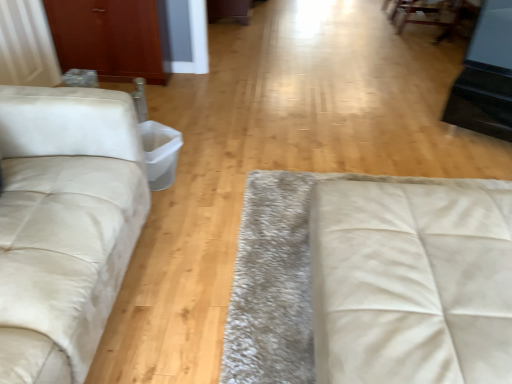
Question: Is suede-like beige studio couch at left, acting as the 1th studio couch starting from the left, outside white leather studio couch at center, placed as the first studio couch when sorted from right to left?

Choices:
 (A) yes
 (B) no

Answer: (A)

Question: Does suede-like beige studio couch at left, acting as the 1th studio couch starting from the left, have a smaller size compared to white leather studio couch at center, placed as the first studio couch when sorted from right to left?

Choices:
 (A) no
 (B) yes

Answer: (A)

Question: Is suede-like beige studio couch at left, acting as the 1th studio couch starting from the left, positioned with its back to white leather studio couch at center, placed as the first studio couch when sorted from right to left?

Choices:
 (A) yes
 (B) no

Answer: (B)

Question: Can you confirm if suede-like beige studio couch at left, the second studio couch viewed from the right, is shorter than white leather studio couch at center, acting as the second studio couch starting from the left?

Choices:
 (A) yes
 (B) no

Answer: (B)

Question: Is suede-like beige studio couch at left, acting as the 1th studio couch starting from the left, at the right side of white leather studio couch at center, placed as the first studio couch when sorted from right to left?

Choices:
 (A) no
 (B) yes

Answer: (A)

Question: From a real-world perspective, is suede-like beige studio couch at left, acting as the 1th studio couch starting from the left, positioned under white leather studio couch at center, placed as the first studio couch when sorted from right to left, based on gravity?

Choices:
 (A) yes
 (B) no

Answer: (B)

Question: Considering the relative positions of white leather studio couch at center, placed as the first studio couch when sorted from right to left, and suede-like beige studio couch at left, acting as the 1th studio couch starting from the left, in the image provided, is white leather studio couch at center, placed as the first studio couch when sorted from right to left, to the left of suede-like beige studio couch at left, acting as the 1th studio couch starting from the left, from the viewer's perspective?

Choices:
 (A) yes
 (B) no

Answer: (B)

Question: Considering the relative sizes of white leather studio couch at center, placed as the first studio couch when sorted from right to left, and suede-like beige studio couch at left, the second studio couch viewed from the right, in the image provided, is white leather studio couch at center, placed as the first studio couch when sorted from right to left, wider than suede-like beige studio couch at left, the second studio couch viewed from the right,?

Choices:
 (A) yes
 (B) no

Answer: (A)

Question: Is white leather studio couch at center, placed as the first studio couch when sorted from right to left, not near suede-like beige studio couch at left, acting as the 1th studio couch starting from the left?

Choices:
 (A) yes
 (B) no

Answer: (B)

Question: From the image's perspective, is white leather studio couch at center, placed as the first studio couch when sorted from right to left, on top of suede-like beige studio couch at left, the second studio couch viewed from the right?

Choices:
 (A) yes
 (B) no

Answer: (B)

Question: Is white leather studio couch at center, placed as the first studio couch when sorted from right to left, at the right side of suede-like beige studio couch at left, the second studio couch viewed from the right?

Choices:
 (A) no
 (B) yes

Answer: (B)

Question: From a real-world perspective, is white leather studio couch at center, placed as the first studio couch when sorted from right to left, positioned over suede-like beige studio couch at left, acting as the 1th studio couch starting from the left, based on gravity?

Choices:
 (A) yes
 (B) no

Answer: (B)

Question: Does white leather studio couch at center, placed as the first studio couch when sorted from right to left, have a lesser width compared to matte wood armoire at upper left?

Choices:
 (A) yes
 (B) no

Answer: (B)